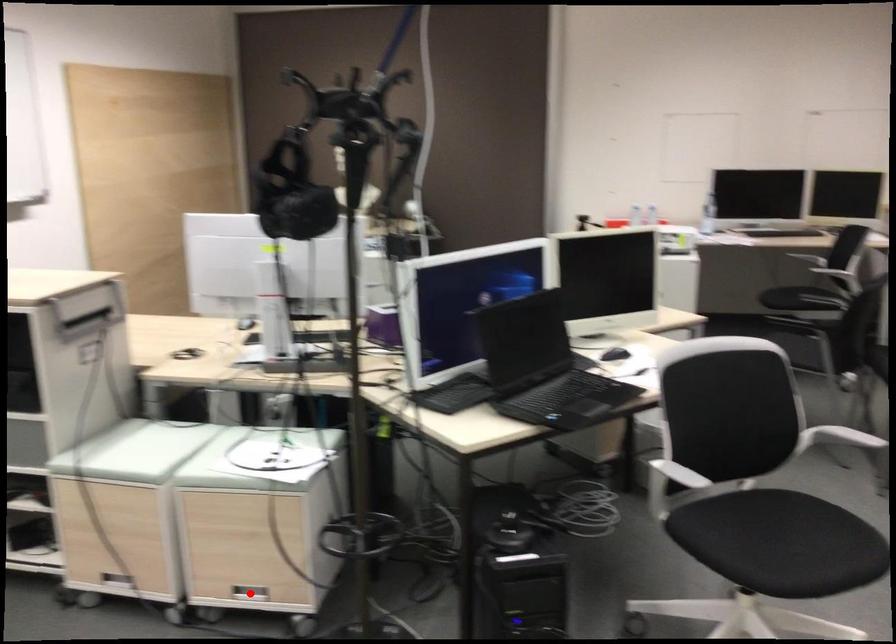
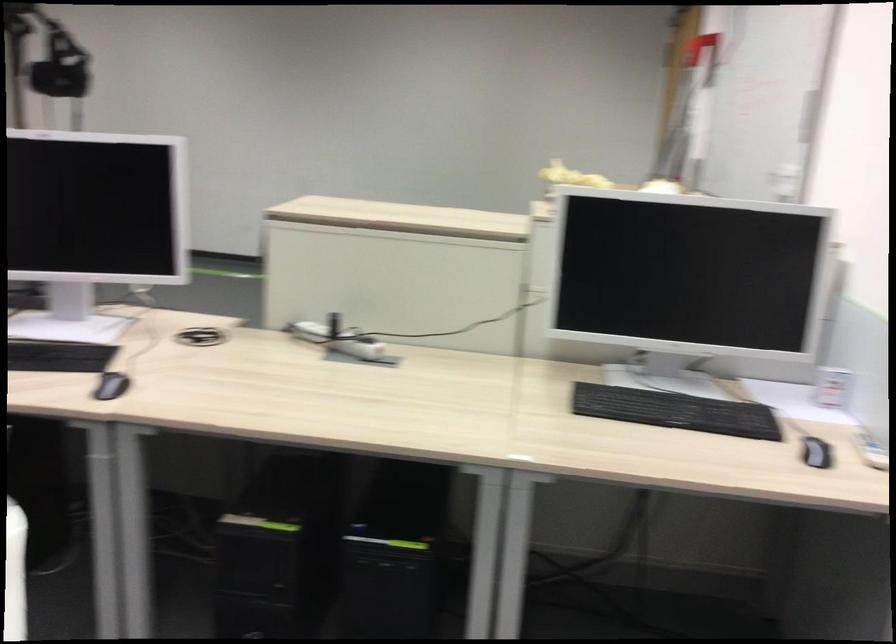
Question: I am providing you with two images of the same scene from different viewpoints. A red point is marked on the first image. Is the red point's position out of view in image 2?

Choices:
 (A) Yes
 (B) No

Answer: (A)